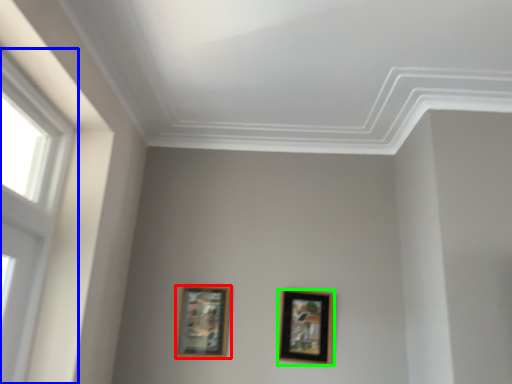
Question: Which object is the farthest from picture frame (highlighted by a red box)? Choose among these: window (highlighted by a blue box) or picture frame (highlighted by a green box).

Choices:
 (A) window
 (B) picture frame

Answer: (A)